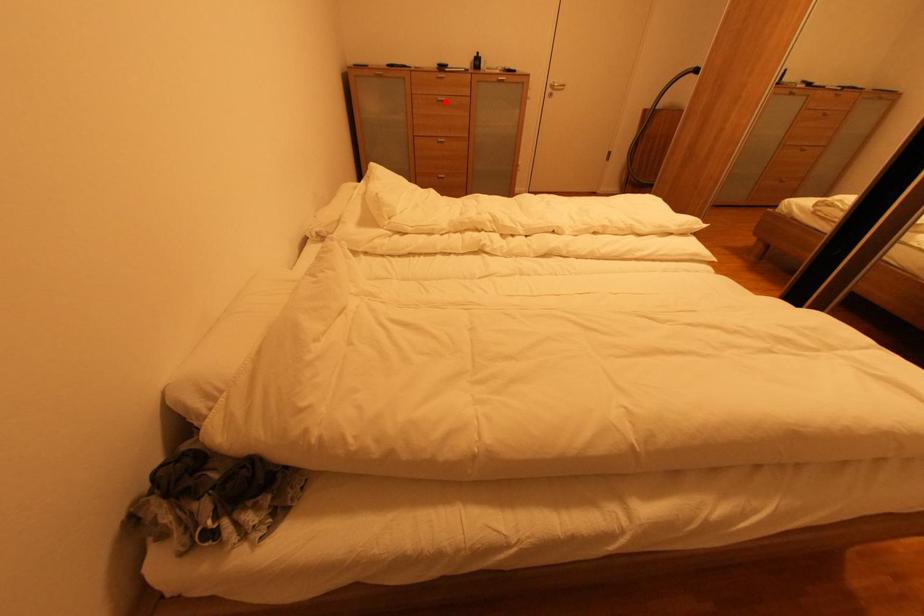
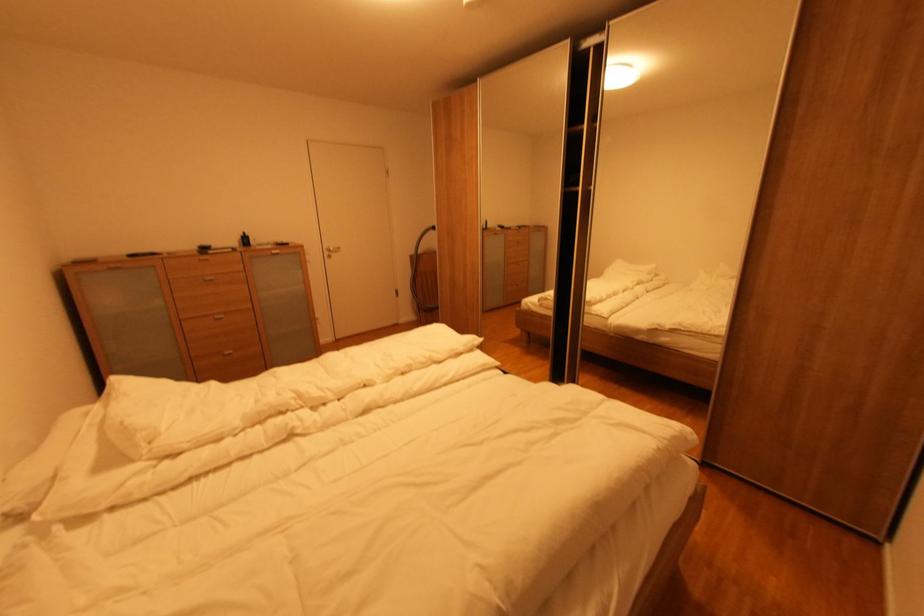
Find the pixel in the second image that matches the highlighted location in the first image.

(213, 282)